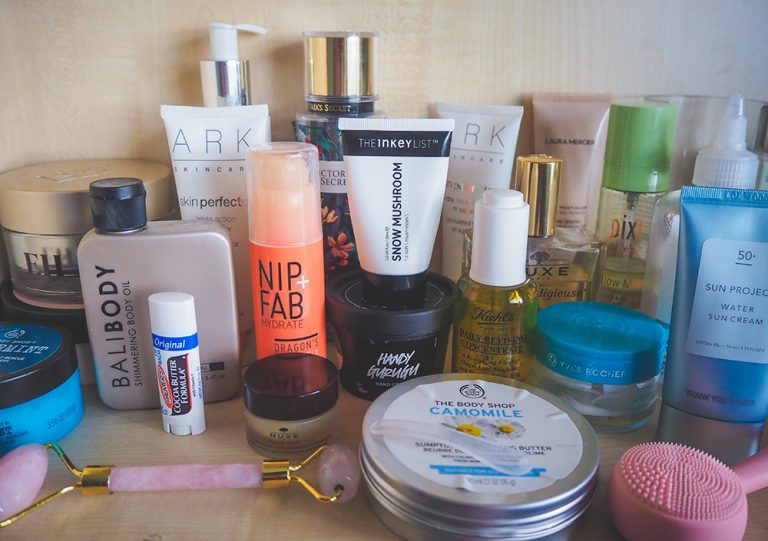
Where is `massager skin facialmassager skin facial`? This screenshot has width=768, height=541. massager skin facialmassager skin facial is located at coordinates (223, 475).